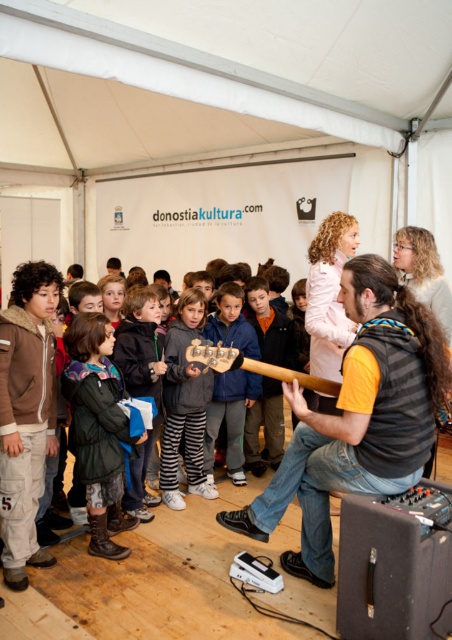
You are a photographer standing at the back of the tented area and want to take a photo of both the gray fleece jacket at center and the wooden guitar at center. Which object will appear closer to the camera in the photo?

The gray fleece jacket at center will appear closer to the camera because it is positioned further to the viewer than the wooden guitar at center.

You are a photographer at the event and need to capture a photo that includes both the blue fabric jacket at center and the wooden guitar at center. Based on their positions, which object should you position on the left side of the frame to ensure both are visible?

The blue fabric jacket at center is to the left of the wooden guitar at center, so you should position the blue fabric jacket at center on the left side of the frame to ensure both are visible.